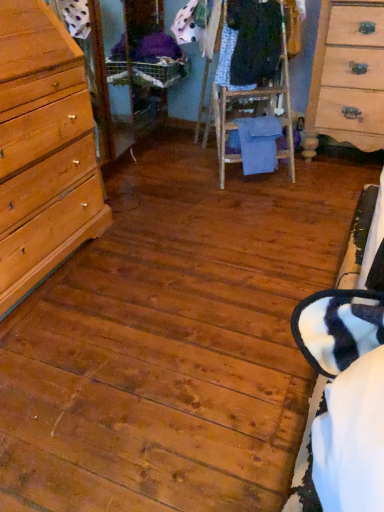
Question: From a real-world perspective, relative to light wood/finish dresser at right, is patterned fabric dress at center, the 2th clothing in the bottom-to-top sequence, vertically above or below?

Choices:
 (A) below
 (B) above

Answer: (B)

Question: Which is correct: patterned fabric dress at center, the 2th clothing in the bottom-to-top sequence, is inside light wood/finish dresser at right, or outside of it?

Choices:
 (A) outside
 (B) inside

Answer: (A)

Question: Estimate the real-world distances between objects in this image. Which object is farther from the patterned fabric dress at center, marked as the 2th clothing in a top-to-bottom arrangement?

Choices:
 (A) light wood/finish dresser at right
 (B) dark blue fabric at center, the 1th clothing in the top-to-bottom sequence
 (C) blue cotton towel at center, marked as the third clothing in a top-to-bottom arrangement

Answer: (A)

Question: Estimate the real-world distances between objects in this image. Which object is closer to the blue cotton towel at center, marked as the third clothing in a top-to-bottom arrangement?

Choices:
 (A) light wood/finish dresser at right
 (B) dark blue fabric at center, which is counted as the 3th clothing, starting from the bottom
 (C) patterned fabric dress at center, marked as the 2th clothing in a top-to-bottom arrangement

Answer: (C)